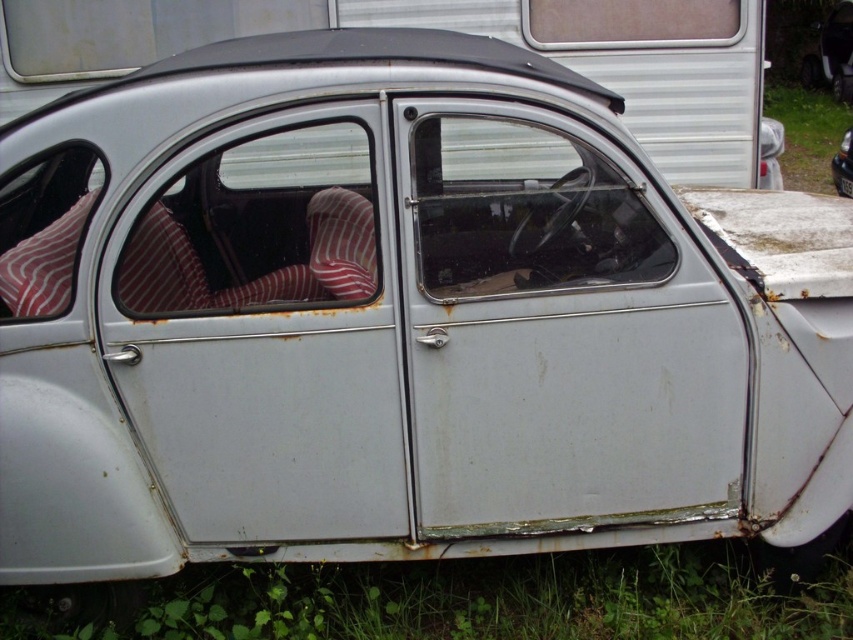
You are standing in a field and see the rusty metal car at center with the green grass at lower center. Which object is closer to you?

The green grass at lower center is closer to you because it is in front of the rusty metal car at center.

You are a gardener trying to mow the lawn around the rusty metal car at center. Based on the image, can you determine if the green grass at lower center is short enough to mow without hitting the car?

The green grass at lower center has a lesser height compared to the rusty metal car at center, so yes, the grass is short enough to mow without hitting the car.